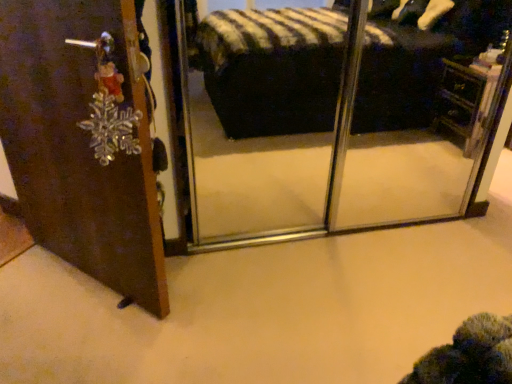
Locate an element on the screen. This screenshot has width=512, height=384. free space to the left of brown wooden door at left is located at coordinates (31, 280).